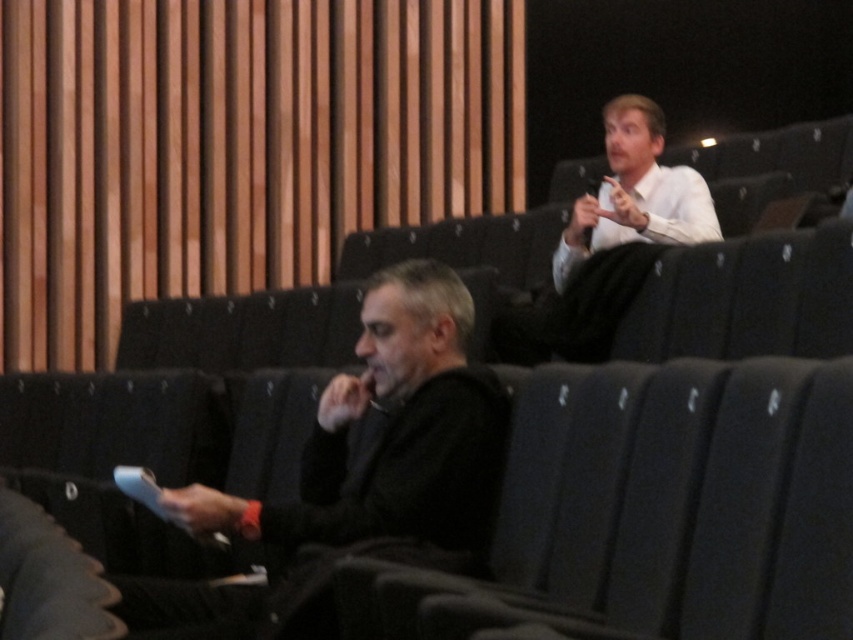
Question: Among these points, which one is farthest from the camera?

Choices:
 (A) (403, 472)
 (B) (602, 243)

Answer: (B)

Question: Does black matte jacket at lower left have a greater width compared to white glossy shirt at upper right?

Choices:
 (A) yes
 (B) no

Answer: (A)

Question: Is black matte jacket at lower left positioned at the back of white glossy shirt at upper right?

Choices:
 (A) no
 (B) yes

Answer: (A)

Question: Which of the following is the closest to the observer?

Choices:
 (A) (329, 480)
 (B) (613, 326)

Answer: (A)

Question: Among these points, which one is farthest from the camera?

Choices:
 (A) click(x=628, y=157)
 (B) click(x=463, y=408)

Answer: (A)

Question: Is black matte jacket at lower left above white glossy shirt at upper right?

Choices:
 (A) yes
 (B) no

Answer: (B)